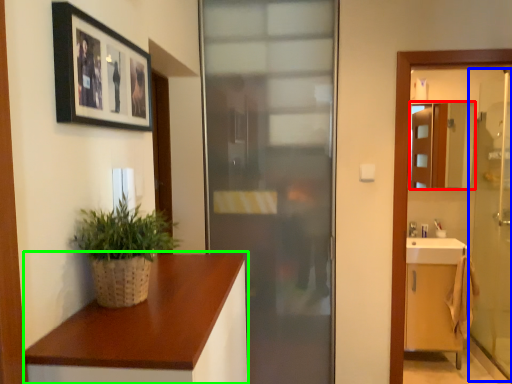
Question: Based on their relative distances, which object is nearer to mirror (highlighted by a red box)? Choose from screen door (highlighted by a blue box) and countertop (highlighted by a green box).

Choices:
 (A) screen door
 (B) countertop

Answer: (A)